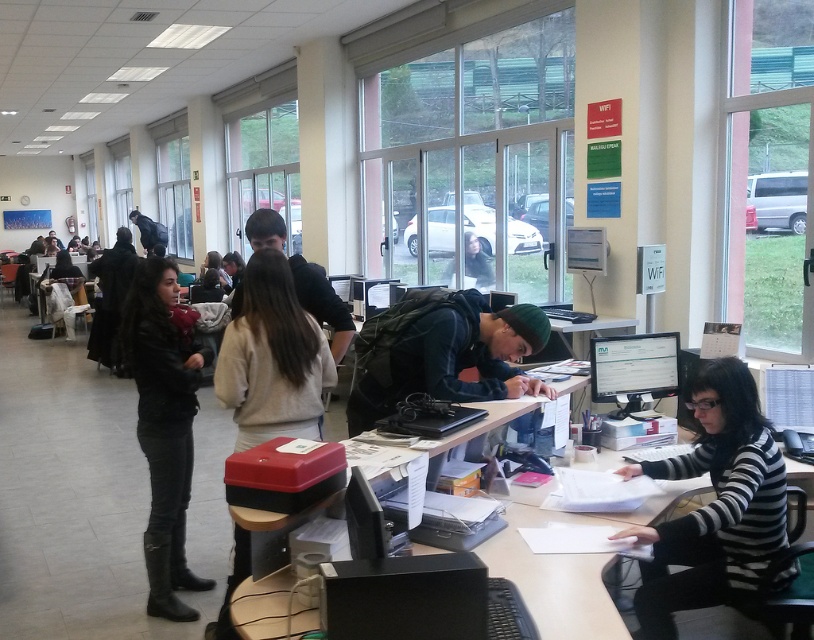
In the scene shown: Who is positioned more to the right, matte black monitor at center or dark brown hair at center?

From the viewer's perspective, matte black monitor at center appears more on the right side.

Who is positioned more to the left, matte black monitor at center or dark brown hair at center?

Positioned to the left is dark brown hair at center.

Identify the location of matte black monitor at center. (633, 369).

Does light beige sweater at center have a lesser height compared to dark brown leather jacket at center?

No.

Can you confirm if light beige sweater at center is wider than dark brown leather jacket at center?

No, light beige sweater at center is not wider than dark brown leather jacket at center.

Image resolution: width=814 pixels, height=640 pixels. I want to click on light beige sweater at center, so click(272, 358).

Can you confirm if dark blue backpack at center is smaller than light beige sweater at center?

Incorrect, dark blue backpack at center is not smaller in size than light beige sweater at center.

Between dark blue backpack at center and light beige sweater at center, which one appears on the right side from the viewer's perspective?

dark blue backpack at center

Identify the location of dark blue backpack at center. (441, 353).